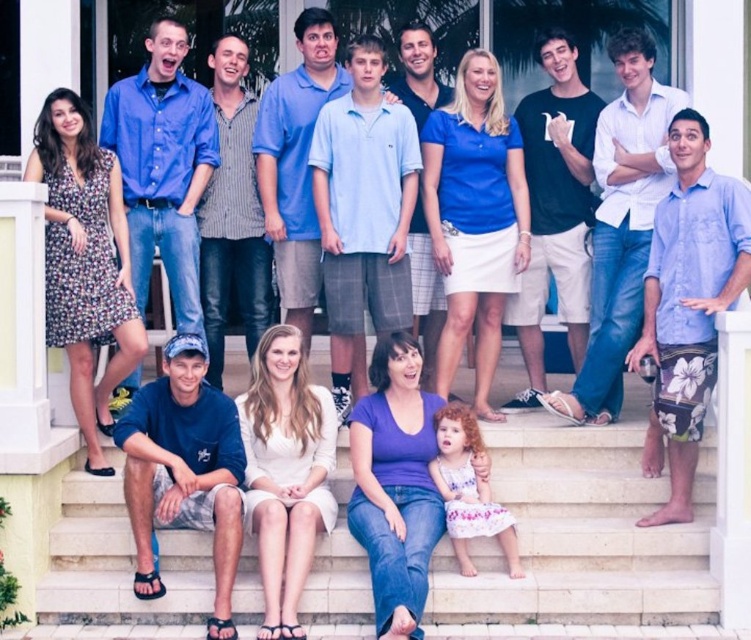
You are standing at the bottom of the white stone stairs at lower center in the image. Looking up, you see the group of people posing on the steps. Based on their arrangement, how many steps are between you and the first person in the front row?

The question cannot be answered with the provided information. The description does not include details about the number of steps between the observer and the people.